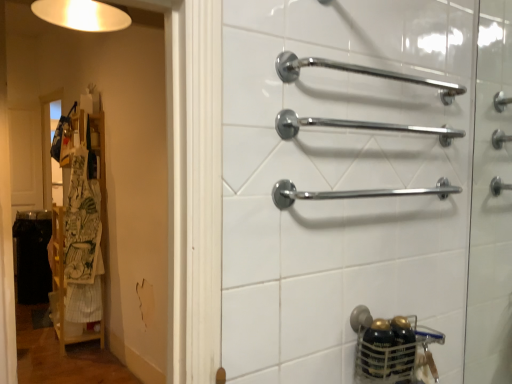
Question: Can you confirm if chrome metallic towel rack at center, the 2th towel rack when ordered from bottom to top, is positioned to the left of chrome metallic towel rack at upper center, positioned as the first towel rack in top-to-bottom order?

Choices:
 (A) yes
 (B) no

Answer: (B)

Question: Is the depth of chrome metallic towel rack at center, the 2th towel rack when ordered from bottom to top, greater than that of chrome metallic towel rack at upper center, positioned as the first towel rack in top-to-bottom order?

Choices:
 (A) no
 (B) yes

Answer: (B)

Question: Is chrome metallic towel rack at center, the second towel rack positioned from the top, shorter than chrome metallic towel rack at upper center, the 3th towel rack in the bottom-to-top sequence?

Choices:
 (A) no
 (B) yes

Answer: (A)

Question: From a real-world perspective, is chrome metallic towel rack at center, the second towel rack positioned from the top, on top of chrome metallic towel rack at upper center, the 3th towel rack in the bottom-to-top sequence?

Choices:
 (A) no
 (B) yes

Answer: (A)

Question: Does chrome metallic towel rack at center, the second towel rack positioned from the top, have a greater width compared to chrome metallic towel rack at upper center, positioned as the first towel rack in top-to-bottom order?

Choices:
 (A) no
 (B) yes

Answer: (B)

Question: Does chrome metallic towel rack at center, the second towel rack positioned from the top, appear on the right side of chrome metallic towel rack at upper center, positioned as the first towel rack in top-to-bottom order?

Choices:
 (A) no
 (B) yes

Answer: (B)

Question: Does polished chrome towel bar at center, which is the 3th towel rack from top to bottom, have a greater width compared to chrome metallic towel rack at center, the second towel rack positioned from the top?

Choices:
 (A) no
 (B) yes

Answer: (A)

Question: Can chrome metallic towel rack at center, the second towel rack positioned from the top, be found inside polished chrome towel bar at center, which appears as the first towel rack when ordered from the bottom?

Choices:
 (A) no
 (B) yes

Answer: (A)

Question: Does polished chrome towel bar at center, which is the 3th towel rack from top to bottom, appear on the left side of chrome metallic towel rack at center, the 2th towel rack when ordered from bottom to top?

Choices:
 (A) yes
 (B) no

Answer: (A)

Question: From a real-world perspective, is polished chrome towel bar at center, which is the 3th towel rack from top to bottom, located beneath chrome metallic towel rack at center, the second towel rack positioned from the top?

Choices:
 (A) yes
 (B) no

Answer: (A)

Question: Is polished chrome towel bar at center, which appears as the first towel rack when ordered from the bottom, looking in the opposite direction of chrome metallic towel rack at center, the second towel rack positioned from the top?

Choices:
 (A) no
 (B) yes

Answer: (A)

Question: From the image's perspective, is polished chrome towel bar at center, which is the 3th towel rack from top to bottom, under chrome metallic towel rack at center, the second towel rack positioned from the top?

Choices:
 (A) yes
 (B) no

Answer: (A)

Question: Does chrome metallic towel rack at center, the 2th towel rack when ordered from bottom to top, appear on the left side of chrome metallic grab bars at right?

Choices:
 (A) yes
 (B) no

Answer: (A)